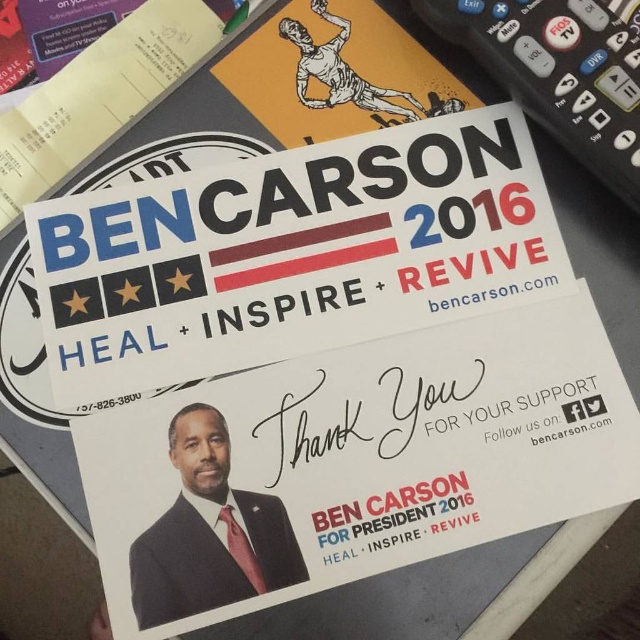
Is black plastic remote at upper right behind matte black suit at center?

Yes, it is.

Consider the image. Between black plastic remote at upper right and matte black suit at center, which one is positioned higher?

black plastic remote at upper right

Describe the element at coordinates (561, 72) in the screenshot. The height and width of the screenshot is (640, 640). I see `black plastic remote at upper right` at that location.

At what (x,y) coordinates should I click in order to perform the action: click on black plastic remote at upper right. Please return your answer as a coordinate pair (x, y). The width and height of the screenshot is (640, 640). Looking at the image, I should click on click(561, 72).